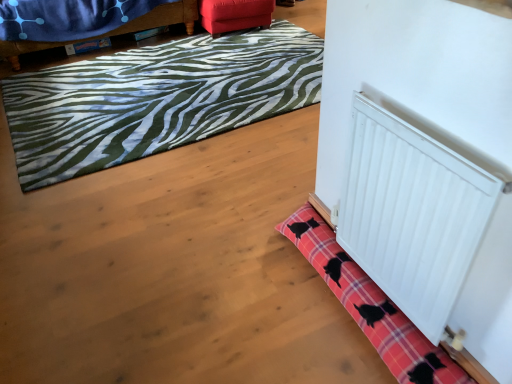
You are a GUI agent. You are given a task and a screenshot of the screen. Output one action in this format:
    pyautogui.click(x=<x>, y=<y>)
    Task: Click on the vacant space in front of green zebra-patterned rug at upper left, the 1th bath mat from the top
    
    Given the screenshot: What is the action you would take?
    coord(187,218)